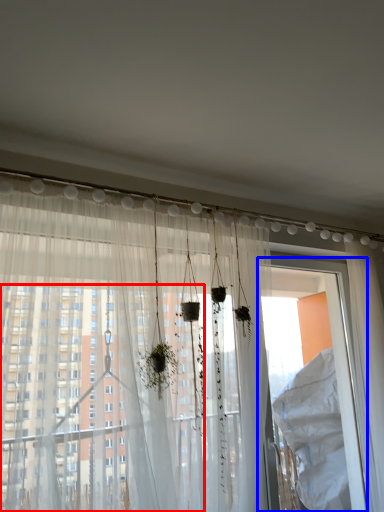
Question: Which point is closer to the camera, window (highlighted by a red box) or screen door (highlighted by a blue box)?

Choices:
 (A) window
 (B) screen door

Answer: (A)